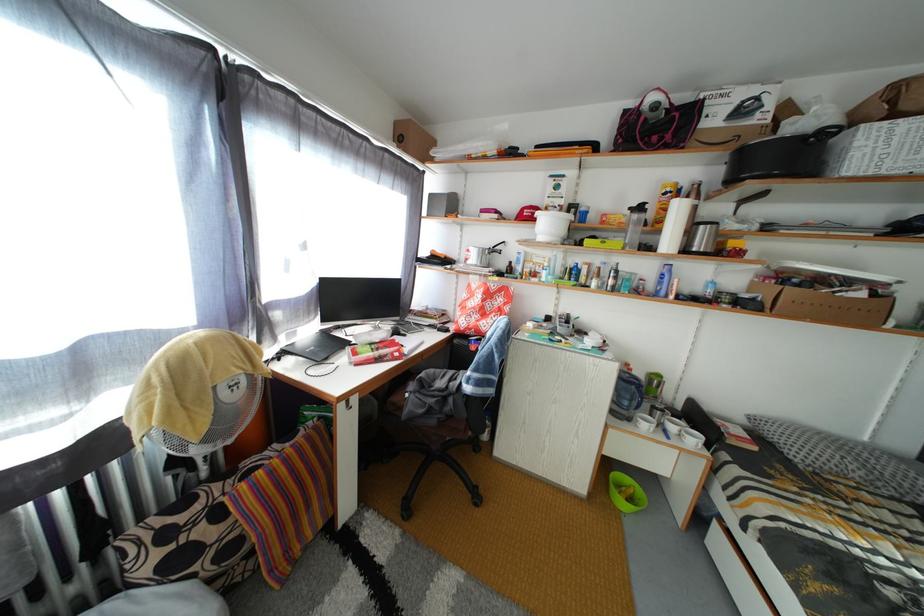
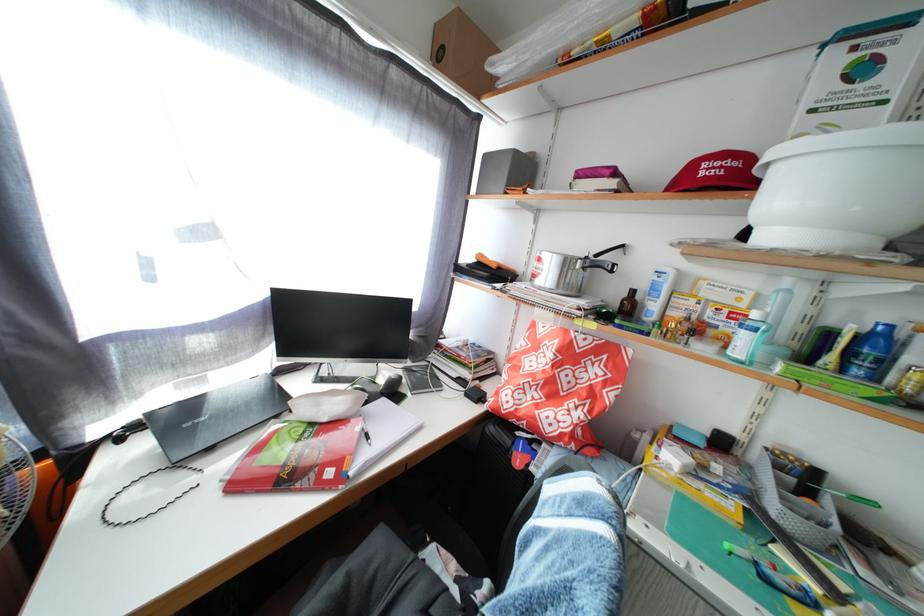
In the second image, find the point that corresponds to (541,217) in the first image.

(736, 169)